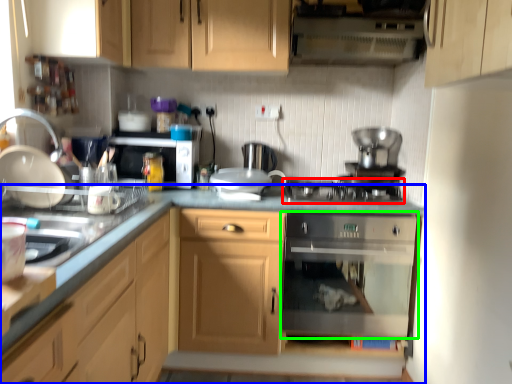
Question: Which object is positioned farthest from gas stove (highlighted by a red box)? Select from cabinetry (highlighted by a blue box) and home appliance (highlighted by a green box).

Choices:
 (A) cabinetry
 (B) home appliance

Answer: (B)